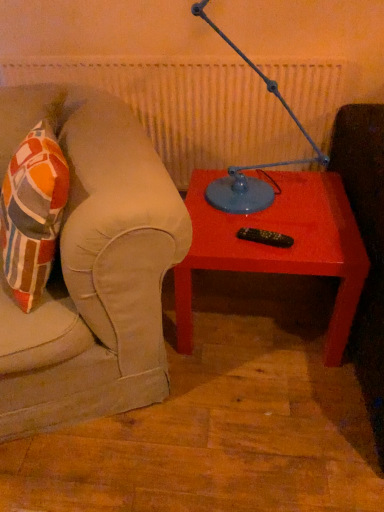
Locate an element on the screen. vacant space underneath matte red table at center (from a real-world perspective) is located at coordinates (249, 312).